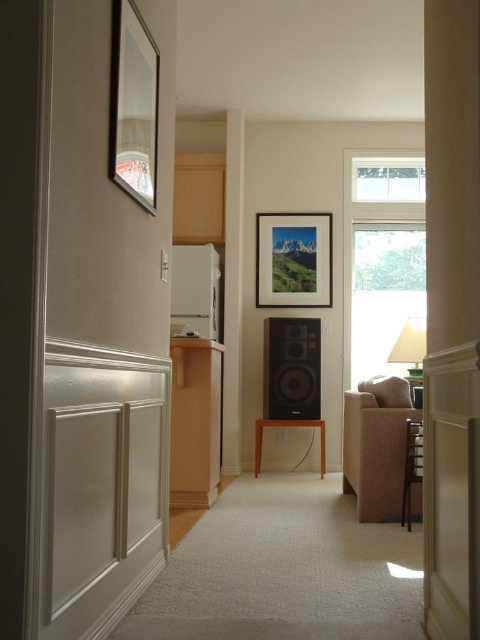
Question: Is black matte speaker at center bigger than matte white lampshade at right?

Choices:
 (A) yes
 (B) no

Answer: (B)

Question: Which object appears farthest from the camera in this image?

Choices:
 (A) beige fabric armchair at lower right
 (B) black matte speaker at center

Answer: (B)

Question: Can you confirm if matte glass picture frame at center is bigger than matte white lampshade at right?

Choices:
 (A) yes
 (B) no

Answer: (B)

Question: Does beige fabric armchair at right have a lesser width compared to beige fabric armchair at lower right?

Choices:
 (A) yes
 (B) no

Answer: (B)

Question: Which object is closer to the camera taking this photo?

Choices:
 (A) black matte speaker at center
 (B) matte glass picture frame at center
 (C) metallic silver picture frame at upper left
 (D) beige fabric armchair at lower right

Answer: (C)

Question: Among these objects, which one is nearest to the camera?

Choices:
 (A) metallic silver picture frame at upper left
 (B) beige fabric armchair at right

Answer: (A)